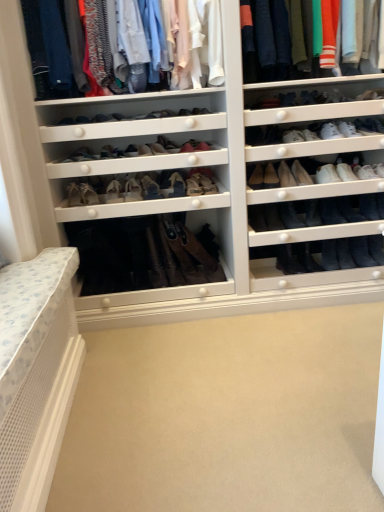
Question: Is black leather boot at center-right, which ranks as the 10th shoe in right-to-left order, bigger or smaller than black leather boot at lower right, the 7th shoe when ordered from right to left?

Choices:
 (A) small
 (B) big

Answer: (A)

Question: Is point (292, 214) positioned closer to the camera than point (317, 266)?

Choices:
 (A) closer
 (B) farther

Answer: (A)

Question: Which object is the farthest from the white leather sneaker at upper right, which is counted as the 6th shoe, starting from the right?

Choices:
 (A) white leather shoe at center, the 11th shoe positioned from the left
 (B) matte white shoe at center, which appears as the eighteenth shoe when viewed from the right
 (C) black suede shoe at lower center, which is counted as the 9th shoe, starting from the right
 (D) black suede shoe at lower right, positioned as the seventeenth shoe in left-to-right order
 (E) matte leather shoe at center, placed as the 17th shoe when sorted from right to left

Answer: (B)

Question: Which object is the farthest from the matte beige shoe at center, which ranks as the sixteenth shoe in right-to-left order?

Choices:
 (A) matte leather shoe at center, placed as the 17th shoe when sorted from right to left
 (B) white leather shoe at center, the eleventh shoe in the right-to-left sequence
 (C) white leather sneaker at upper right, which is counted as the 6th shoe, starting from the right
 (D) black leather boot at lower right, which is counted as the fifteenth shoe, starting from the left
 (E) matte white shoe at center, which appears as the eighteenth shoe when viewed from the right

Answer: (C)